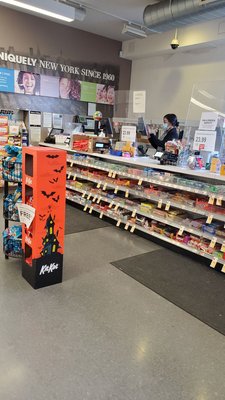
Locate an element on the screen. This screenshot has width=225, height=400. wall is located at coordinates (170, 94).